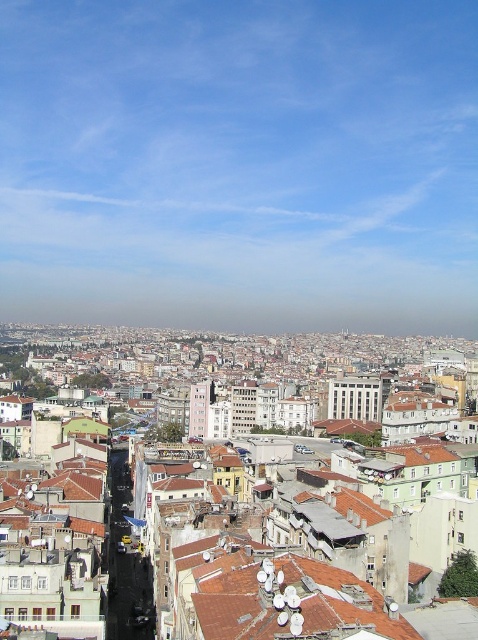
Does brown tile roof at center have a lesser width compared to white concrete building at center?

No.

Is brown tile roof at center smaller than white concrete building at center?

Indeed, brown tile roof at center has a smaller size compared to white concrete building at center.

Find the location of a particular element. brown tile roof at center is located at coordinates (293, 604).

Who is shorter, white concrete building at center or pink concrete building at center?

Standing shorter between the two is white concrete building at center.

Which is more to the left, white concrete building at center or pink concrete building at center?

pink concrete building at center

Between point (366, 396) and point (199, 403), which one is positioned behind?

The point (199, 403) is behind.

I want to click on white concrete building at center, so click(x=357, y=396).

Who is positioned more to the left, brown tile roof at center or pink concrete building at center?

From the viewer's perspective, pink concrete building at center appears more on the left side.

Which is in front, point (217, 582) or point (196, 413)?

Point (217, 582) is in front.

Who is more forward, (307,627) or (206,410)?

Point (307,627)

The image size is (478, 640). Find the location of `brown tile roof at center`. brown tile roof at center is located at coordinates (293, 604).